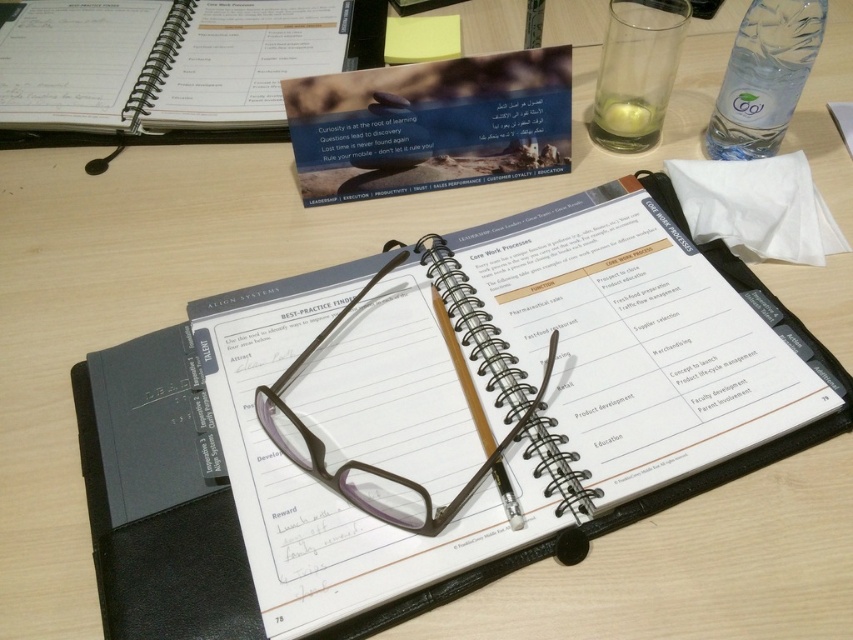
Question: Can you confirm if black spiral notebook at center is positioned to the right of spiral-bound paper at center?

Choices:
 (A) no
 (B) yes

Answer: (B)

Question: Which point is farther to the camera?

Choices:
 (A) clear plastic bottle at upper right
 (B) white paper at upper right

Answer: (B)

Question: Does black spiral notebook at center appear on the right side of brown plastic glasses at center?

Choices:
 (A) yes
 (B) no

Answer: (A)

Question: Considering the real-world distances, which object is closest to the white paper at upper right?

Choices:
 (A) black spiral notebook at center
 (B) clear plastic bottle at upper right
 (C) spiral-bound paper at center
 (D) brown plastic glasses at center

Answer: (B)

Question: Estimate the real-world distances between objects in this image. Which object is closer to the black spiral notebook at center?

Choices:
 (A) brown plastic glasses at center
 (B) white paper at upper right
 (C) spiral-bound paper at center
 (D) clear plastic bottle at upper right

Answer: (A)

Question: Does black spiral notebook at center have a smaller size compared to spiral-bound paper at center?

Choices:
 (A) yes
 (B) no

Answer: (B)